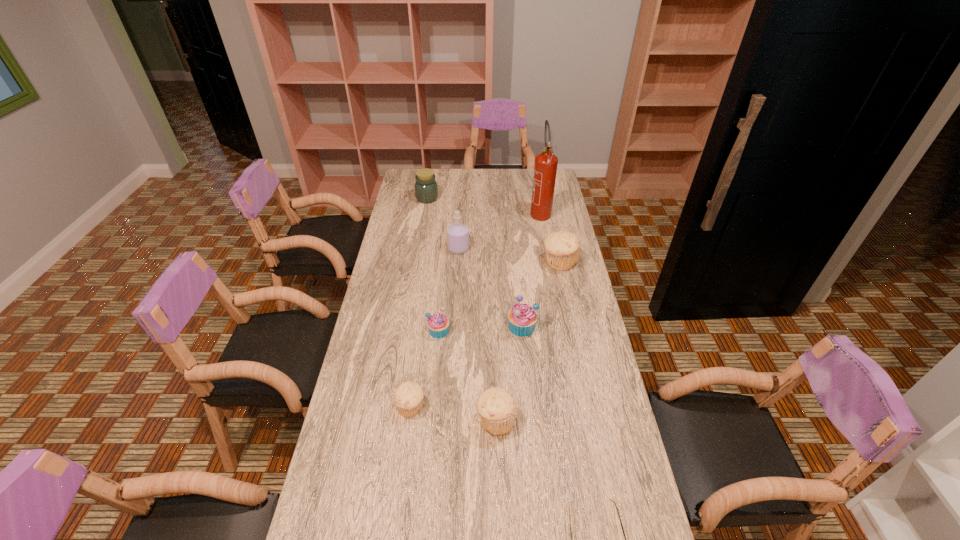
At what (x,y) coordinates should I click in order to perform the action: click on fire extinguisher. Please return your answer as a coordinate pair (x, y). The image size is (960, 540). Looking at the image, I should click on (545, 168).

Locate an element on the screen. This screenshot has height=540, width=960. red fire extinguisher is located at coordinates (545, 168).

Locate an element on the screen. The height and width of the screenshot is (540, 960). perfume is located at coordinates (458, 233).

The image size is (960, 540). I want to click on purple perfume, so click(x=458, y=233).

Find the location of a particular element. This screenshot has height=540, width=960. jar is located at coordinates (426, 189).

Where is `the farthest beige muffin`? The image size is (960, 540). the farthest beige muffin is located at coordinates (562, 248).

Where is `the rightmost beige muffin`? The image size is (960, 540). the rightmost beige muffin is located at coordinates (562, 248).

I want to click on the right blue muffin, so click(522, 318).

Find the location of `the second biggest beige muffin`. the second biggest beige muffin is located at coordinates point(497,408).

At what (x,y) coordinates should I click in order to perform the action: click on the smaller blue muffin. Please return your answer as a coordinate pair (x, y). Looking at the image, I should click on (438, 324).